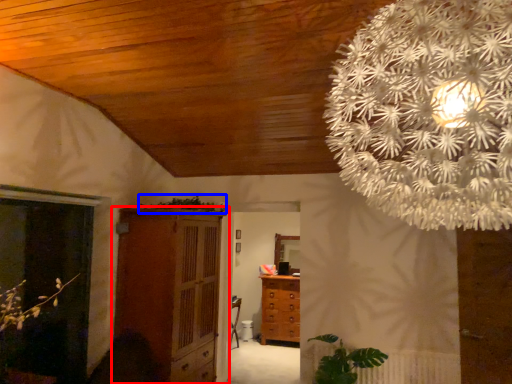
Question: Among these objects, which one is farthest to the camera, cupboard (highlighted by a red box) or plant (highlighted by a blue box)?

Choices:
 (A) cupboard
 (B) plant

Answer: (B)